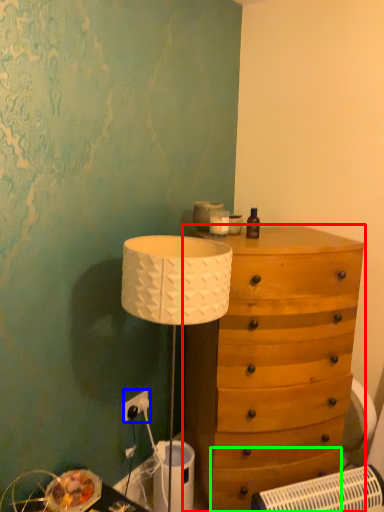
Question: Which is farther away from chest of drawers (highlighted by a red box)? electric outlet (highlighted by a blue box) or drawer (highlighted by a green box)?

Choices:
 (A) electric outlet
 (B) drawer

Answer: (A)